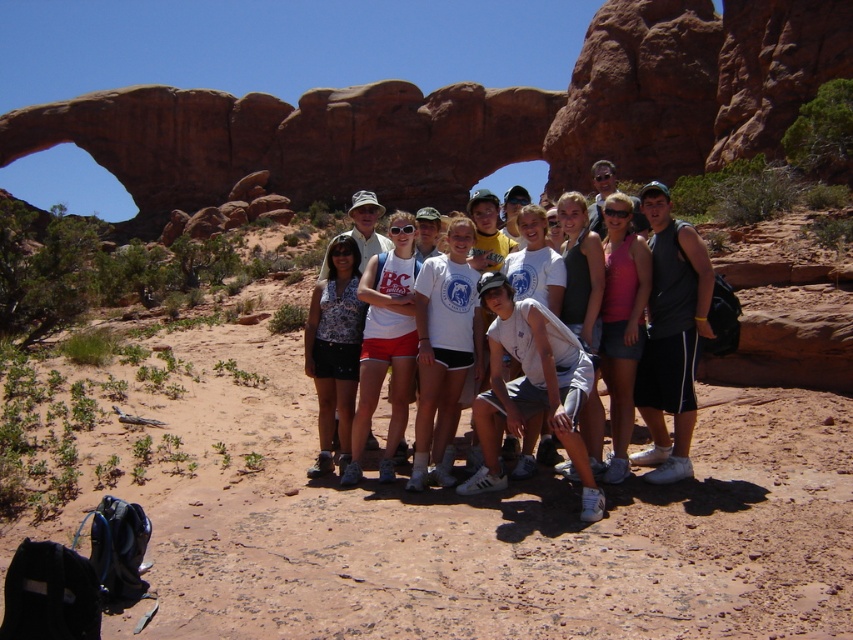
Question: Does white cotton t-shirt at center appear over printed fabric tank top at center?

Choices:
 (A) yes
 (B) no

Answer: (A)

Question: Which object is the farthest from the pink fabric tank top at center?

Choices:
 (A) white cotton tank top at center
 (B) printed fabric tank top at center
 (C) matte gray tank top at center
 (D) white cotton t-shirt at center

Answer: (B)

Question: Which point is closer to the camera taking this photo?

Choices:
 (A) (498, 346)
 (B) (328, 248)
 (C) (392, 296)

Answer: (A)

Question: Which is farther from the printed fabric tank top at center?

Choices:
 (A) white cotton t-shirt at center
 (B) white cotton tank top at center
 (C) pink fabric tank top at center

Answer: (C)

Question: Can you confirm if white cotton tank top at center is bigger than matte gray tank top at center?

Choices:
 (A) no
 (B) yes

Answer: (A)

Question: Does pink fabric tank top at center appear under matte gray tank top at center?

Choices:
 (A) no
 (B) yes

Answer: (B)